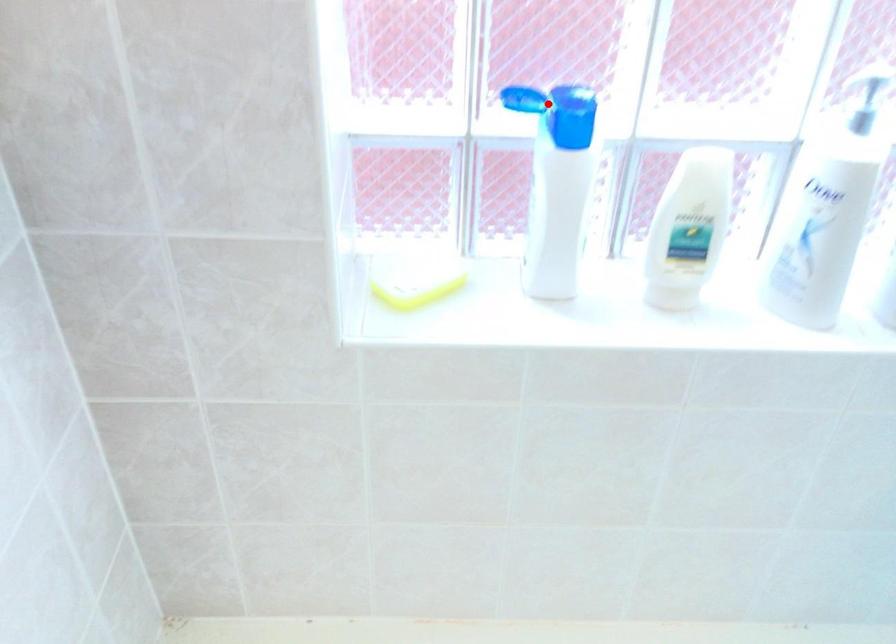
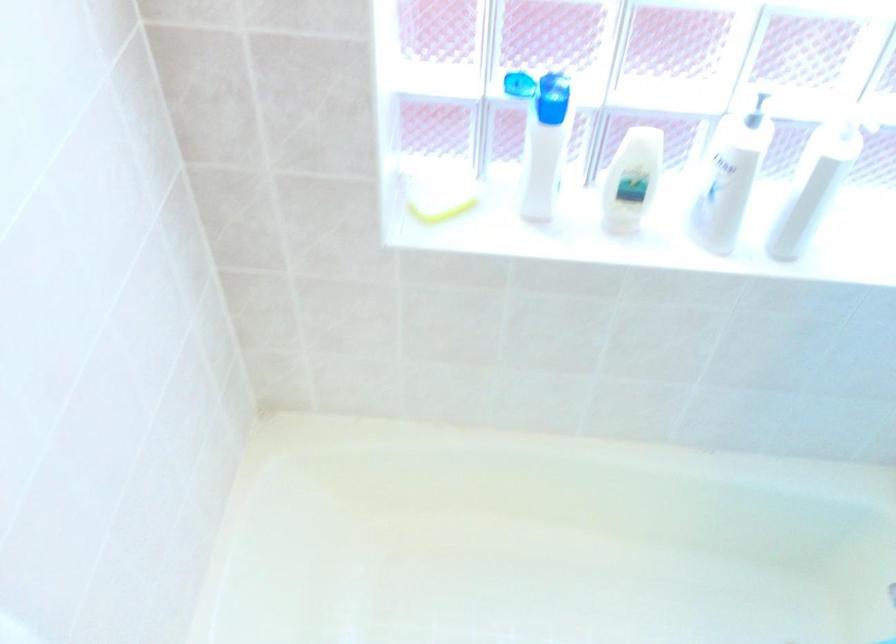
Question: I am providing you with two images of the same scene from different viewpoints. Image1 has a red point marked. In image2, the corresponding 3D location appears at what relative position? Reply with the corresponding letter.

Choices:
 (A) Closer
 (B) Farther

Answer: (B)